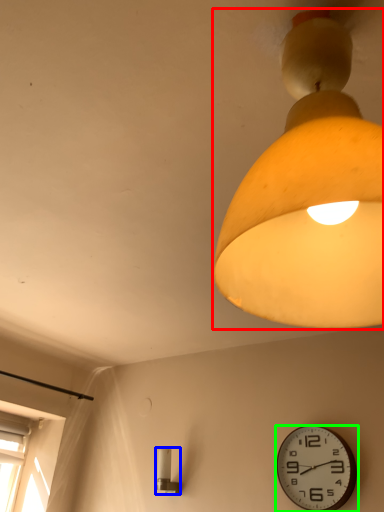
Question: Considering the real-world distances, which object is farthest from lamp (highlighted by a red box)? lamp (highlighted by a blue box) or wall clock (highlighted by a green box)?

Choices:
 (A) lamp
 (B) wall clock

Answer: (A)